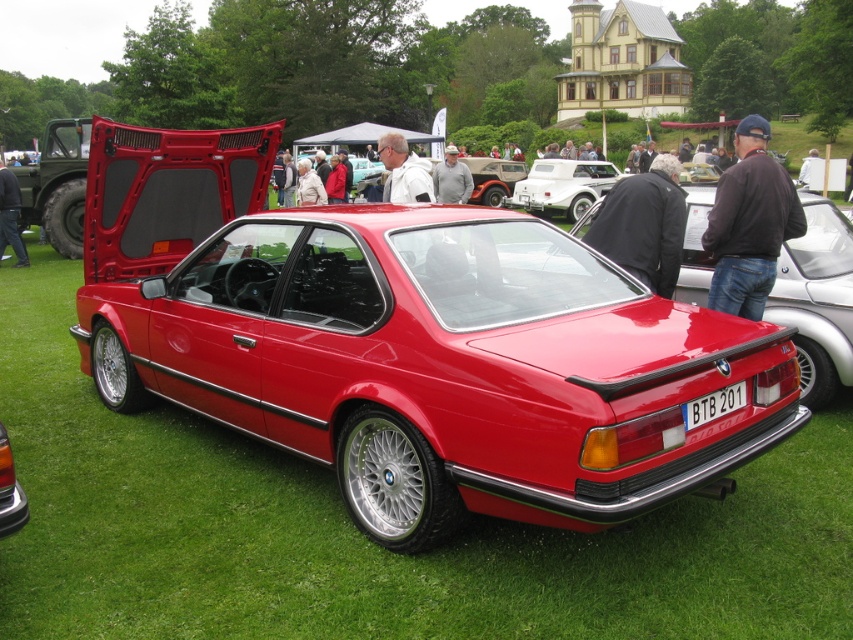
You are a photographer at a car show and want to capture both the white matte convertible at center and the gray sweater at center in a single frame. Which object should you focus on first to ensure both are in the frame?

The white matte convertible at center is larger than the gray sweater at center, so you should focus on the white matte convertible at center first to ensure both fit within the frame.

Looking at this image, you are a photographer at the car exhibition and need to place a black leather jacket at center and jeans at lower left in the scene. Which object should be placed lower to avoid blocking the view of the BMW car?

The black leather jacket at center should be placed lower since it is not as tall as the jeans at lower left, ensuring it doesn

You are a photographer at the car exhibition and want to take a picture of the black leather jacket at center. Where should you position yourself to capture it in the frame?

To capture the black leather jacket at center in the frame, position yourself directly in front of it since it is located at the center of the scene.